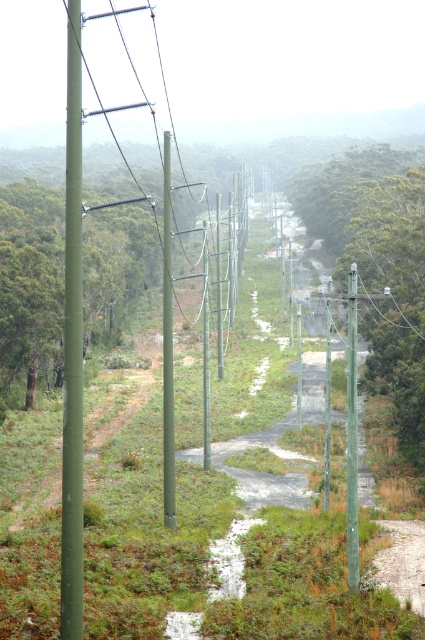
Is green textured pole at center further to camera compared to green matte pole at center?

Yes, green textured pole at center is further from the viewer.

Who is shorter, green textured pole at center or green matte pole at center?

Standing shorter between the two is green matte pole at center.

Is point (388, 180) farther from viewer compared to point (163, 243)?

Yes, point (388, 180) is farther from viewer.

Image resolution: width=425 pixels, height=640 pixels. What are the coordinates of `green textured pole at center` in the screenshot? It's located at (379, 264).

Who is more distant from viewer, (73, 116) or (164, 515)?

Point (164, 515)

Can you confirm if green matte telegraph pole at left is taller than green matte pole at center?

Correct, green matte telegraph pole at left is much taller as green matte pole at center.

Between point (65, 476) and point (164, 177), which one is positioned in front?

Point (65, 476)

Locate an element on the screen. green matte telegraph pole at left is located at coordinates (73, 346).

In the scene shown: Does green textured pole at center appear on the right side of green matte telegraph pole at left?

Correct, you'll find green textured pole at center to the right of green matte telegraph pole at left.

Can you confirm if green textured pole at center is positioned above green matte telegraph pole at left?

Yes, green textured pole at center is above green matte telegraph pole at left.

Does point (333, 243) come closer to viewer compared to point (70, 211)?

No, (333, 243) is behind (70, 211).

Locate an element on the screen. This screenshot has width=425, height=640. green textured pole at center is located at coordinates (379, 264).